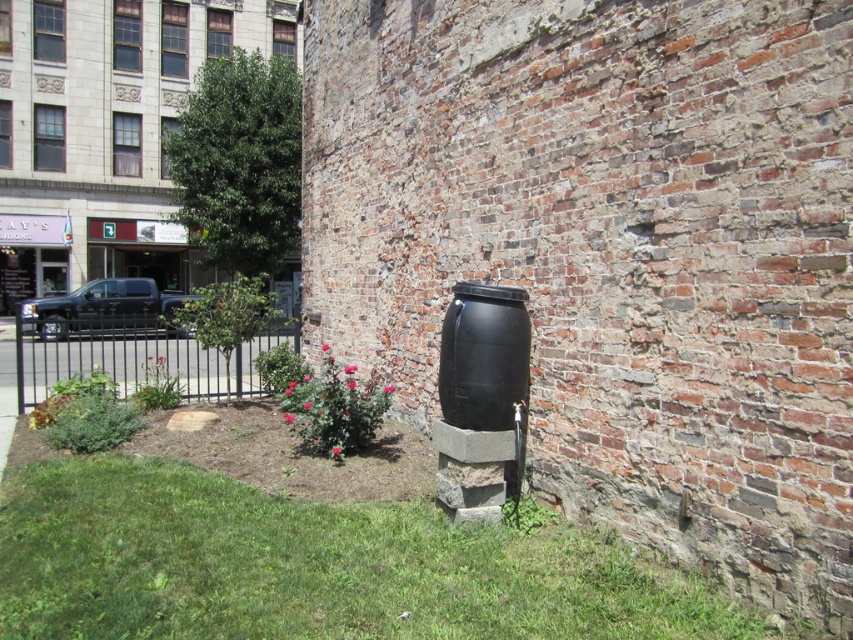
You are a gardener who wants to plant a new flower bed. You see the green grass at lower center and the black metal fence at lower left. Which object is located below the other?

The green grass at lower center is positioned under the black metal fence at lower left, so the grass is below the fence.

What are the coordinates of the green grass at lower center?

The green grass at lower center is located at coordinates point (314, 566).